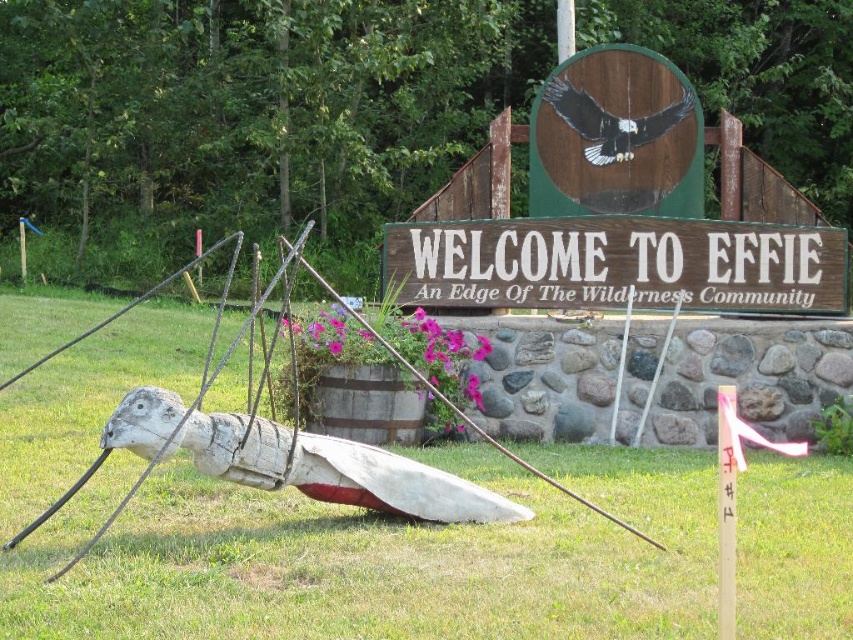
Question: Which of the following is the closest to the observer?

Choices:
 (A) wooden sign at center
 (B) green grass at lower center

Answer: (B)

Question: Does green grass at lower center appear over wooden sign at center?

Choices:
 (A) yes
 (B) no

Answer: (B)

Question: Can you confirm if green grass at lower center is positioned above wooden sign at center?

Choices:
 (A) no
 (B) yes

Answer: (A)

Question: In this image, where is green grass at lower center located relative to wooden sign at center?

Choices:
 (A) left
 (B) right

Answer: (A)